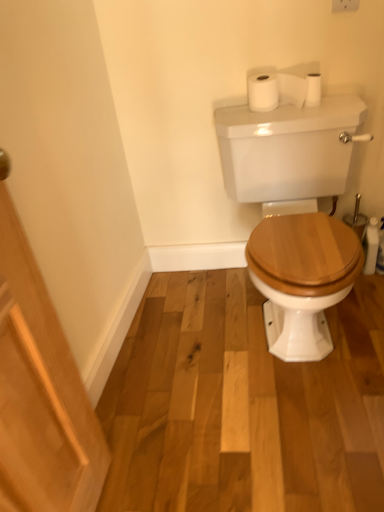
Question: Is white matte toilet paper at upper right, the 2th toilet paper viewed from the left, wider or thinner than white glossy porcelain at center?

Choices:
 (A) wide
 (B) thin

Answer: (B)

Question: From a real-world perspective, relative to white glossy porcelain at center, is white matte toilet paper at upper right, the first toilet paper when ordered from right to left, vertically above or below?

Choices:
 (A) below
 (B) above

Answer: (B)

Question: Considering the real-world distances, which object is farthest from the white glossy porcelain at center?

Choices:
 (A) white matte toilet paper at upper center, which is the 1th toilet paper from left to right
 (B) white matte toilet paper at upper right, the first toilet paper when ordered from right to left

Answer: (B)

Question: Which is farther from the white glossy porcelain at center?

Choices:
 (A) white matte toilet paper at upper center, which is counted as the second toilet paper, starting from the right
 (B) white matte toilet paper at upper right, the 2th toilet paper viewed from the left

Answer: (B)